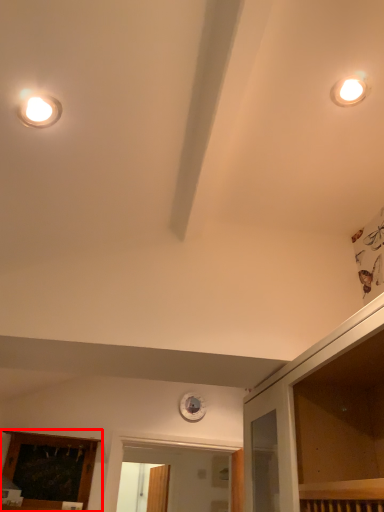
Question: From the image's perspective, what is the correct spatial relationship of elevator (annotated by the red box) in relation to dresser?

Choices:
 (A) below
 (B) above

Answer: (A)